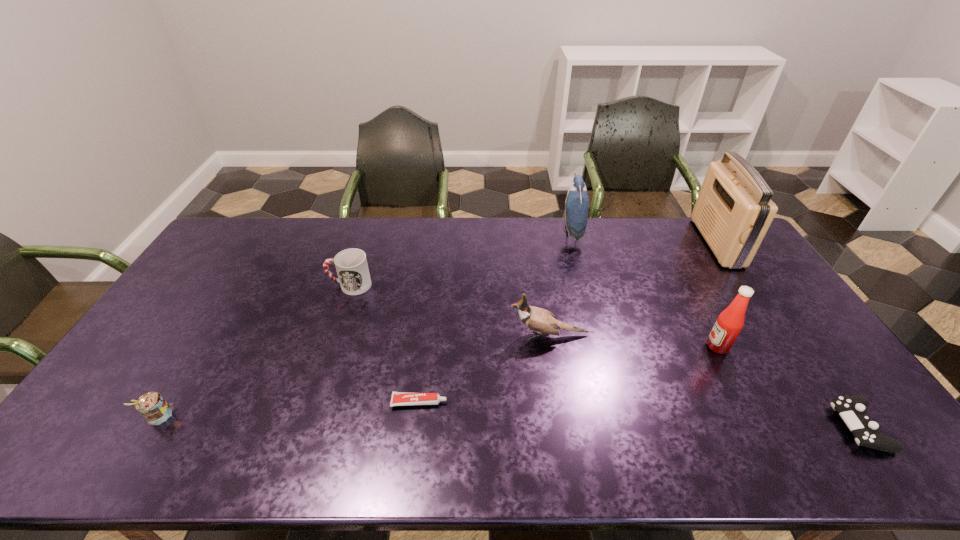
Where is `vacant space located on the surface of the second shortest object`? This screenshot has width=960, height=540. vacant space located on the surface of the second shortest object is located at coordinates (770, 427).

This screenshot has height=540, width=960. Identify the location of blank space located at the nozzle of the toothpaste. [x=482, y=402].

At what (x,y) coordinates should I click in order to perform the action: click on radio receiver at the far edge. Please return your answer as a coordinate pair (x, y). The image size is (960, 540). Looking at the image, I should click on (733, 211).

At what (x,y) coordinates should I click in order to perform the action: click on bird situated at the far edge. Please return your answer as a coordinate pair (x, y). Looking at the image, I should click on (577, 201).

Locate an element on the screen. This screenshot has width=960, height=540. object at the near edge is located at coordinates (852, 409).

You are a GUI agent. You are given a task and a screenshot of the screen. Output one action in this format:
    pyautogui.click(x=<x>, y=<y>)
    Task: Click on the object located in the left edge section of the desktop
    This screenshot has height=540, width=960.
    Given the screenshot: What is the action you would take?
    pyautogui.click(x=152, y=406)

The width and height of the screenshot is (960, 540). What are the coordinates of `radio receiver that is at the right edge` in the screenshot? It's located at (733, 211).

What are the coordinates of `control present at the right edge` in the screenshot? It's located at pyautogui.click(x=852, y=409).

Image resolution: width=960 pixels, height=540 pixels. Find the location of `object positioned at the far right corner`. object positioned at the far right corner is located at coordinates (733, 211).

Where is `object present at the near right corner`? The width and height of the screenshot is (960, 540). object present at the near right corner is located at coordinates (852, 409).